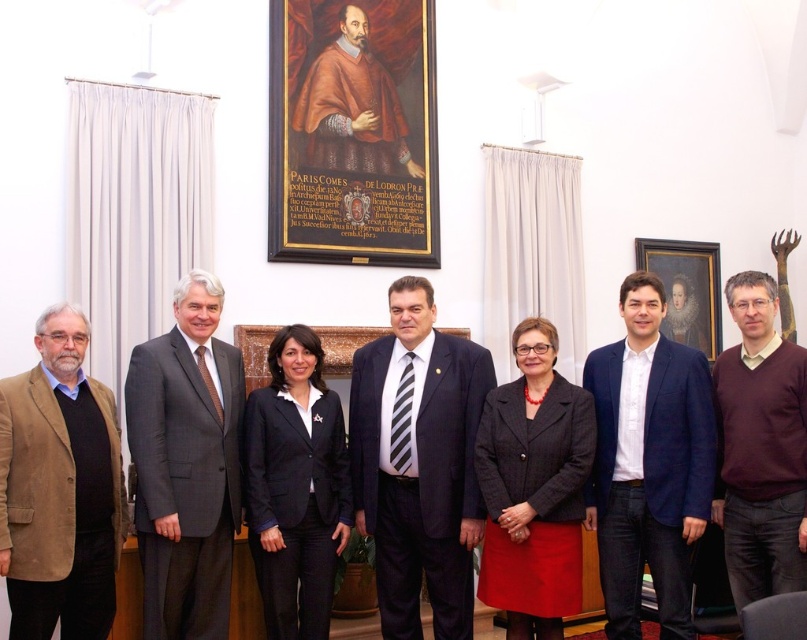
Which of these two, matte gray suit at center or dark purple sweater at center, stands shorter?

Standing shorter between the two is dark purple sweater at center.

Does matte gray suit at center lie behind dark purple sweater at center?

Yes, it is.

Is point (203, 412) positioned after point (764, 280)?

No, it is in front of (764, 280).

Identify the location of matte gray suit at center. (186, 465).

Does brown suede blazer at left come in front of black fabric blazer at center?

Yes, it is in front of black fabric blazer at center.

I want to click on brown suede blazer at left, so click(59, 488).

Looking at this image, does dark gray textured blazer at center have a smaller size compared to wooden picture frame at center?

No.

Between point (523, 397) and point (705, 259), which one is positioned in front?

Positioned in front is point (523, 397).

Where is `dark gray textured blazer at center`? The width and height of the screenshot is (807, 640). dark gray textured blazer at center is located at coordinates (533, 486).